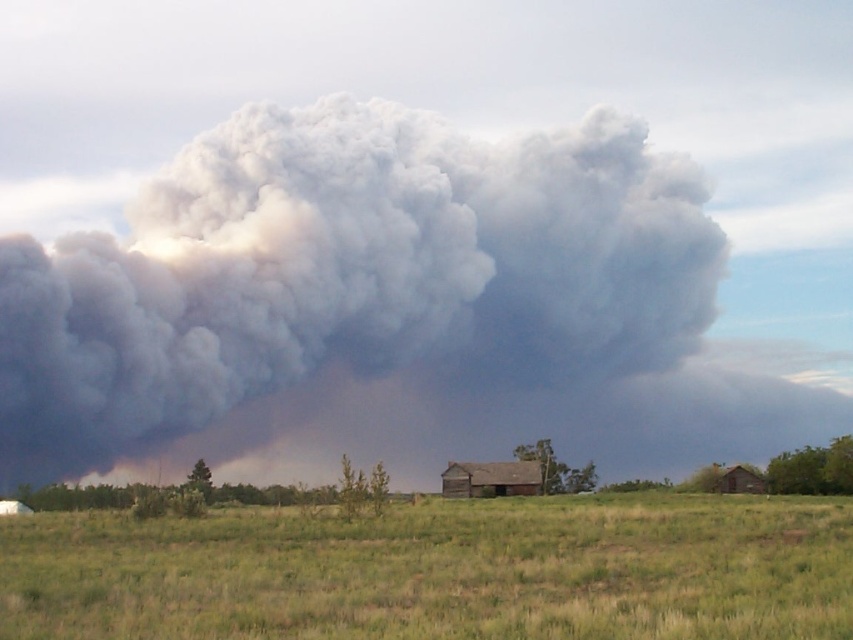
Is gray/dense smoke at center taller than green grass at center?

Correct, gray/dense smoke at center is much taller as green grass at center.

I want to click on gray/dense smoke at center, so click(349, 275).